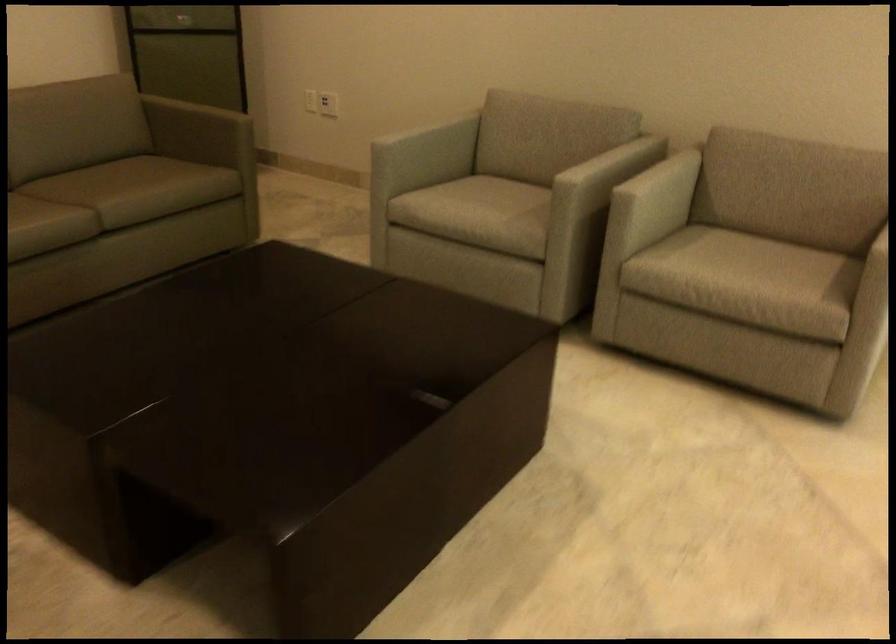
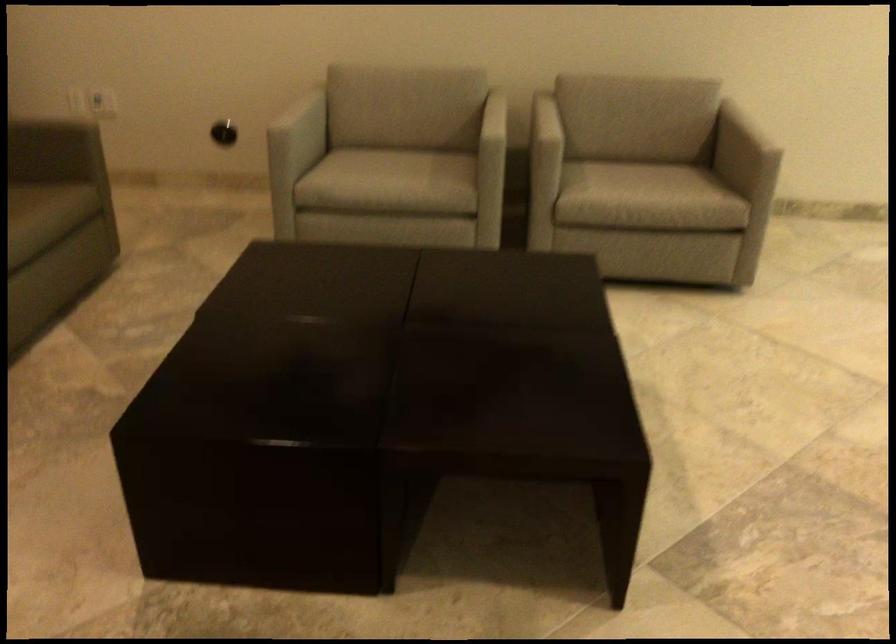
Where in the second image is the point corresponding to [661,187] from the first image?

(543, 126)